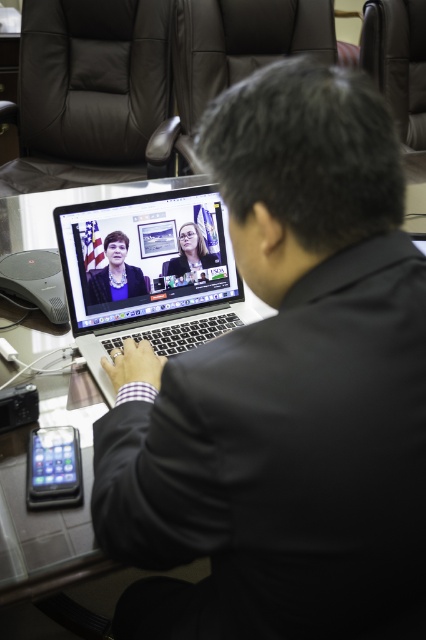
You are looking at the laptop screen during the video call. There are two points marked on the screen at coordinates point (161, 545) and point (176, 276). Which point is closer to you?

Point (161, 545) is closer to the viewer than point (176, 276).

You are standing in front of a desk and want to place a new laptop exactly where the black matte laptop at center is currently located. What coordinates should you use?

The black matte laptop at center is located at coordinates point (284, 390), so you should place the new laptop at those coordinates.

You are setting up a desk for a video call and have both the black matte laptop at center and the sleek silver laptop at center. You want to place the taller one closer to the camera for better visibility. Which laptop should you choose?

The black matte laptop at center is much taller than the sleek silver laptop at center, so you should choose the black matte laptop at center to place closer to the camera for better visibility.